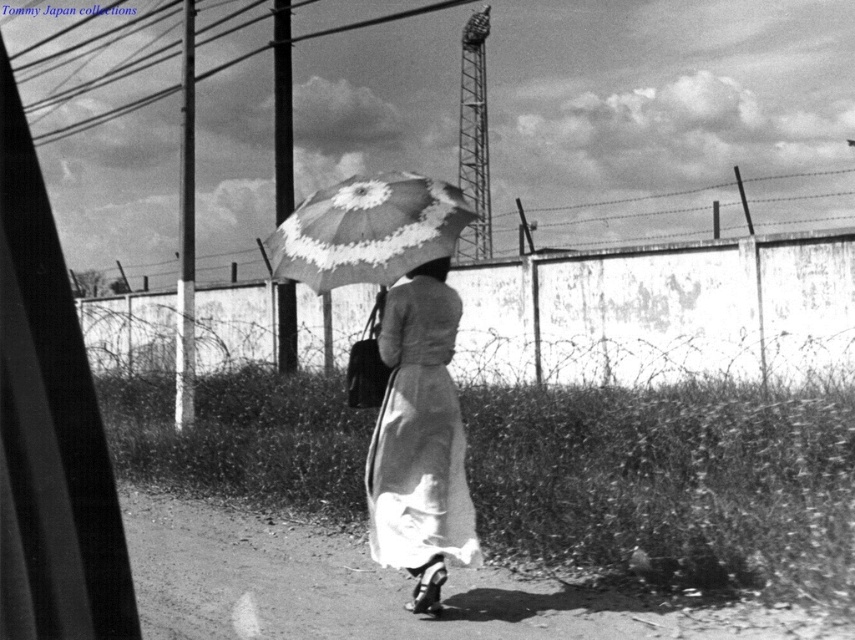
Can you confirm if matte gray dress at center is shorter than smooth fabric hat at upper center?

Incorrect, matte gray dress at center's height does not fall short of smooth fabric hat at upper center's.

Does point (369, 545) lie behind point (429, 266)?

Yes, it is.

The height and width of the screenshot is (640, 855). I want to click on matte gray dress at center, so pyautogui.click(x=417, y=435).

Which is in front, point (411, 444) or point (275, 262)?

Positioned in front is point (411, 444).

Who is positioned more to the left, matte gray dress at center or white floral-patterned umbrella at center?

From the viewer's perspective, white floral-patterned umbrella at center appears more on the left side.

I want to click on matte gray dress at center, so click(417, 435).

Who is positioned more to the right, white floral-patterned umbrella at center or smooth fabric hat at upper center?

smooth fabric hat at upper center is more to the right.

Who is more forward, (274, 244) or (420, 269)?

Positioned in front is point (420, 269).

I want to click on white floral-patterned umbrella at center, so click(x=369, y=230).